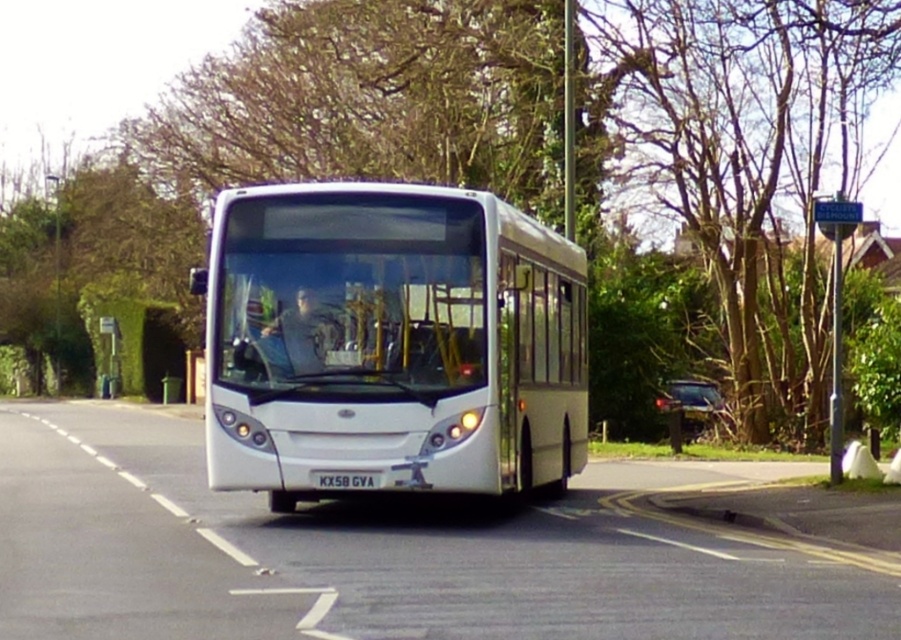
You are a passenger in the white bus and looking out the window. You see two points marked on the road ahead. The first point is at coordinates point (692, 150) and the second is at point (365, 477). Which point is closer to the bus?

Point (692, 150) is further to the viewer than point (365, 477), so the point closer to the bus is point (365, 477).

You are a pedestrian standing on the sidewalk next to the road where the white metallic bus at center is driving. You want to know if the bus is taller than the black plastic license plate at center. Can you confirm this?

Yes, the white metallic bus at center is taller than the black plastic license plate at center according to the description.